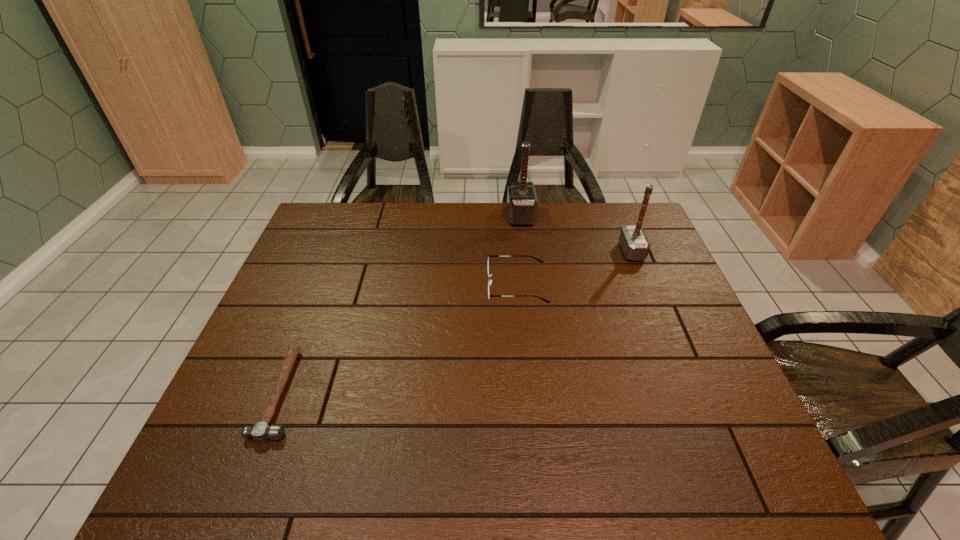
Find the location of a particular element. The width and height of the screenshot is (960, 540). free space located 0.110m on the striking surface of the rightmost hammer is located at coordinates (587, 251).

Find the location of `free spot located on the striking surface of the rightmost hammer`. free spot located on the striking surface of the rightmost hammer is located at coordinates (507, 251).

The width and height of the screenshot is (960, 540). Identify the location of vacant area located 0.130m on the lenses of the spectacles. (443, 285).

At what (x,y) coordinates should I click in order to perform the action: click on free region located on the lenses of the spectacles. Please return your answer as a coordinate pair (x, y). This screenshot has height=540, width=960. Looking at the image, I should click on (425, 285).

Where is `free spot located 0.090m on the lenses of the spectacles`? The width and height of the screenshot is (960, 540). free spot located 0.090m on the lenses of the spectacles is located at coordinates (456, 285).

You are a GUI agent. You are given a task and a screenshot of the screen. Output one action in this format:
    pyautogui.click(x=<x>, y=<y>)
    Task: Click on the vacant space located 0.060m on the striking face of the nearest object
    This screenshot has height=540, width=960.
    Given the screenshot: What is the action you would take?
    pyautogui.click(x=325, y=393)

Find the location of `object located at the left edge`. object located at the left edge is located at coordinates (261, 431).

Find the location of `object located at the right edge`. object located at the right edge is located at coordinates (634, 243).

The image size is (960, 540). In order to click on object present at the far right corner in this screenshot , I will do point(634,243).

Find the location of a particular element. Image resolution: width=960 pixels, height=540 pixels. free space at the far edge is located at coordinates (519, 243).